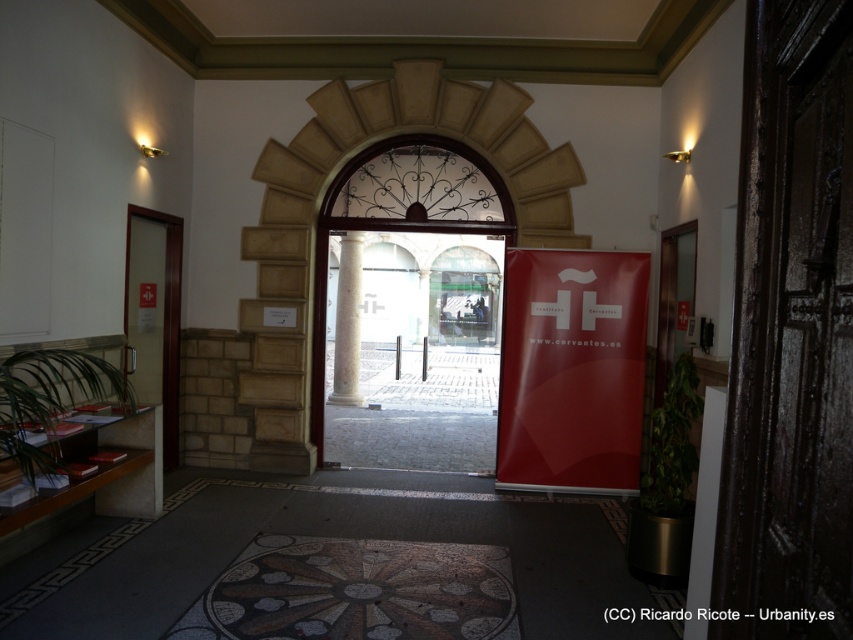
Question: Which point is closer to the camera taking this photo?

Choices:
 (A) (727, 528)
 (B) (625, 368)
 (C) (347, 292)

Answer: (A)

Question: Which point is farther from the camera taking this photo?

Choices:
 (A) (763, 330)
 (B) (338, 307)
 (C) (335, 349)
 (D) (521, 300)

Answer: (B)

Question: Is white glossy pillar at right smaller than white marble column at center?

Choices:
 (A) yes
 (B) no

Answer: (A)

Question: Does transparent glass door at left lie in front of white glossy pillar at right?

Choices:
 (A) yes
 (B) no

Answer: (B)

Question: Among these points, which one is farthest from the camera?

Choices:
 (A) (456, 371)
 (B) (740, 212)
 (C) (175, 266)
 (D) (705, 460)

Answer: (A)

Question: Does transparent glass door at left have a lesser width compared to white marble column at center?

Choices:
 (A) yes
 (B) no

Answer: (B)